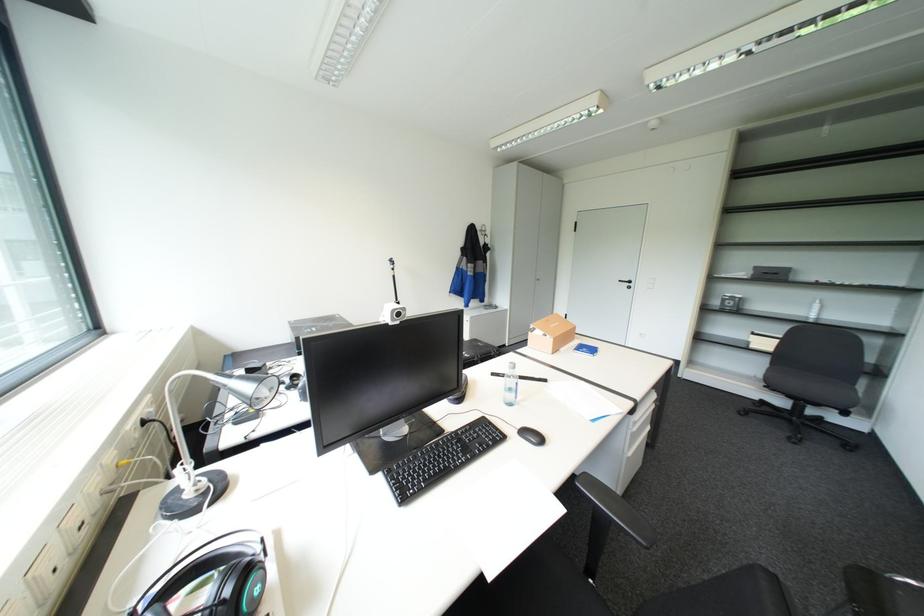
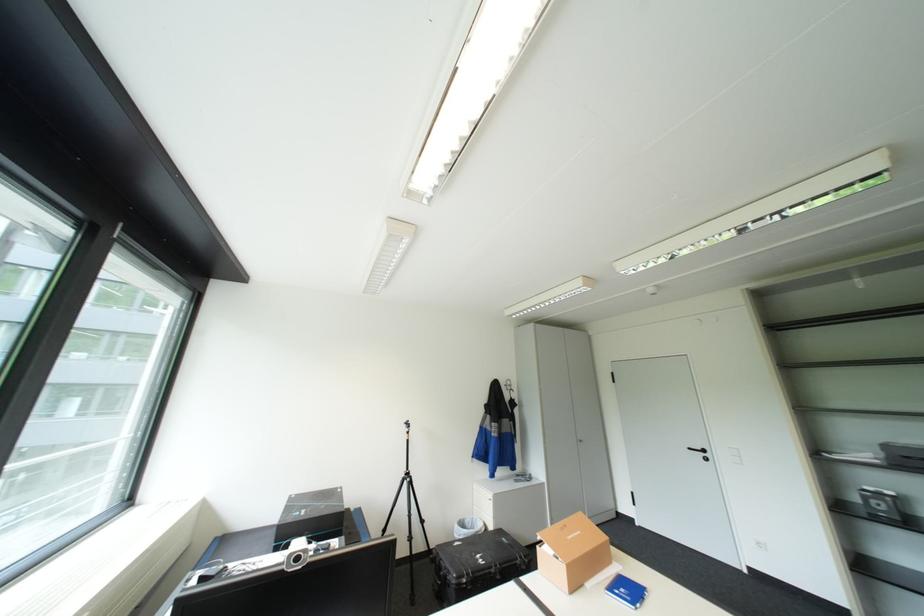
Locate, in the second image, the point that corresponds to (538,331) in the first image.

(545, 545)